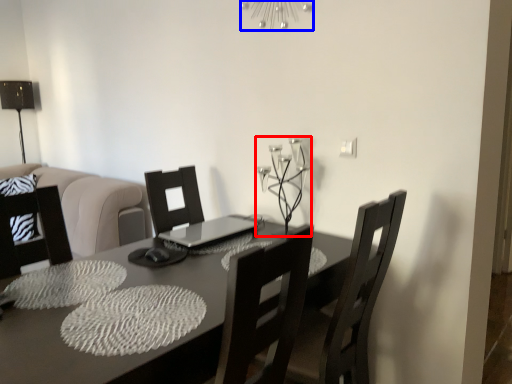
Question: Among these objects, which one is farthest to the camera, candle holder (highlighted by a red box) or light fixture (highlighted by a blue box)?

Choices:
 (A) candle holder
 (B) light fixture

Answer: (B)